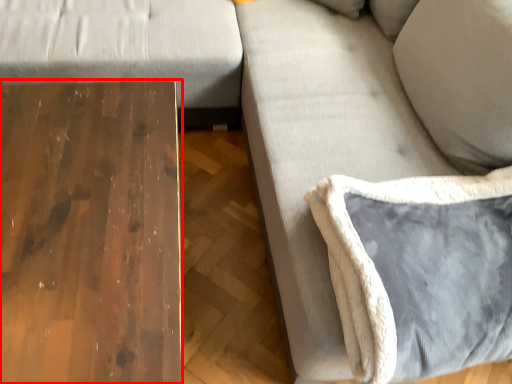
Question: Observing the image, what is the correct spatial positioning of table (annotated by the red box) in reference to pillow?

Choices:
 (A) left
 (B) right

Answer: (A)